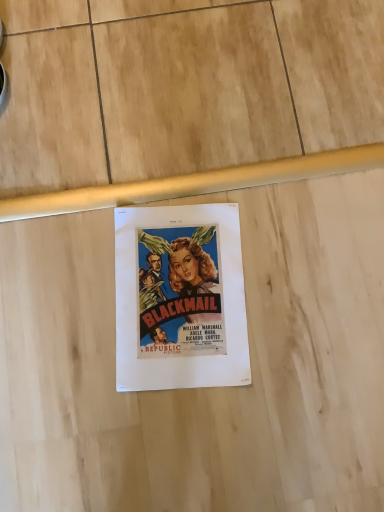
Question: Should I look upward or downward to see white paper poster at center?

Choices:
 (A) down
 (B) up

Answer: (A)